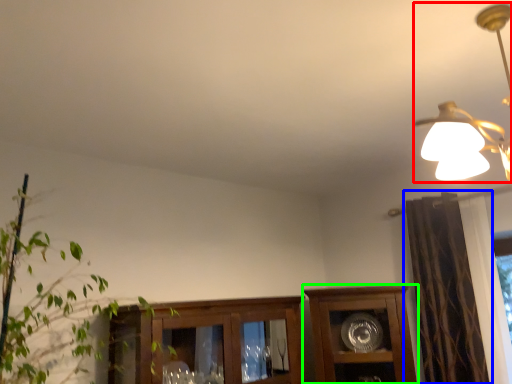
Question: Considering the real-world distances, which object is farthest from lamp (highlighted by a red box)? curtain (highlighted by a blue box) or cabinetry (highlighted by a green box)?

Choices:
 (A) curtain
 (B) cabinetry

Answer: (B)